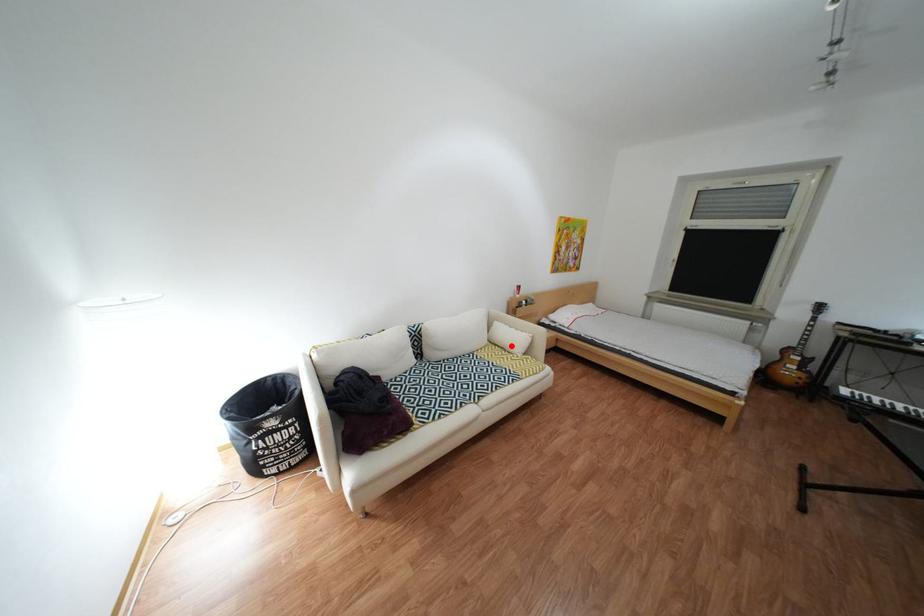
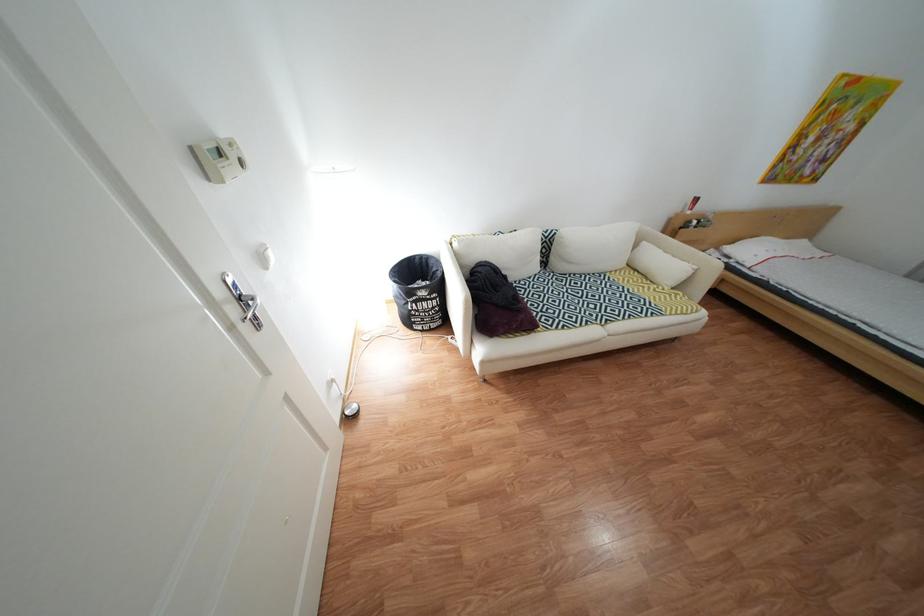
Locate, in the second image, the point that corresponds to the highlighted location in the first image.

(651, 272)